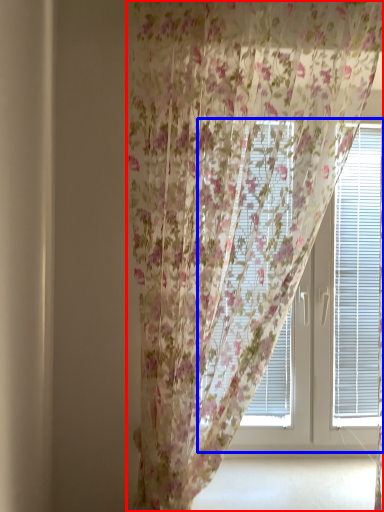
Question: Which object appears farthest to the camera in this image, curtain (highlighted by a red box) or bay window (highlighted by a blue box)?

Choices:
 (A) curtain
 (B) bay window

Answer: (B)